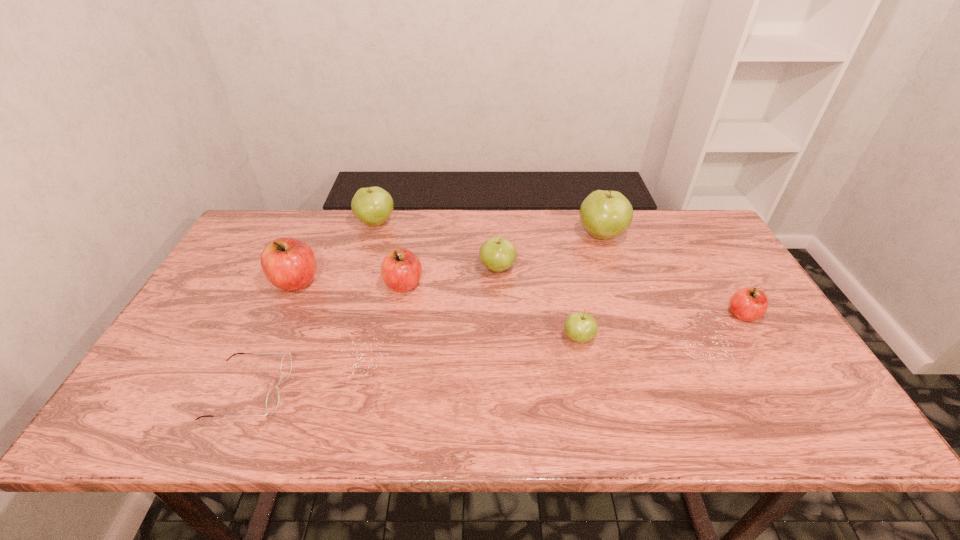
What are the coordinates of `the second apple from right to left` in the screenshot? It's located at (606, 214).

Identify the location of the tallest apple. The height and width of the screenshot is (540, 960). (606, 214).

Find the location of `the third smallest green apple`. the third smallest green apple is located at coordinates (373, 206).

At what (x,y) coordinates should I click in order to perform the action: click on the leftmost green apple. Please return your answer as a coordinate pair (x, y). Looking at the image, I should click on (373, 206).

Locate an element on the screen. Image resolution: width=960 pixels, height=540 pixels. the leftmost red apple is located at coordinates (289, 264).

Image resolution: width=960 pixels, height=540 pixels. I want to click on the leftmost apple, so click(x=289, y=264).

You are a GUI agent. You are given a task and a screenshot of the screen. Output one action in this format:
    pyautogui.click(x=<x>, y=<y>)
    Task: Click on the fourth apple from right to left
    This screenshot has width=960, height=540.
    Given the screenshot: What is the action you would take?
    [497, 254]

At what (x,y) coordinates should I click in order to perform the action: click on the second nearest green apple. Please return your answer as a coordinate pair (x, y). This screenshot has height=540, width=960. Looking at the image, I should click on (497, 254).

Find the location of a particular element. the second smallest red apple is located at coordinates (401, 270).

At what (x,y) coordinates should I click in order to perform the action: click on the second red apple from right to left. Please return your answer as a coordinate pair (x, y). This screenshot has width=960, height=540. Looking at the image, I should click on (401, 270).